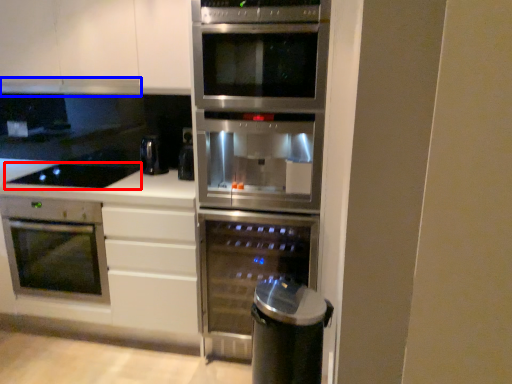
Question: Which object is closer to the camera taking this photo, gas stove (highlighted by a red box) or exhaust hood (highlighted by a blue box)?

Choices:
 (A) gas stove
 (B) exhaust hood

Answer: (A)